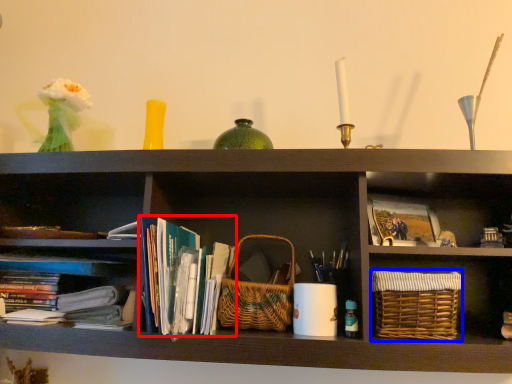
Question: Which of the following is the farthest to the observer, book (highlighted by a red box) or basket (highlighted by a blue box)?

Choices:
 (A) book
 (B) basket

Answer: (B)